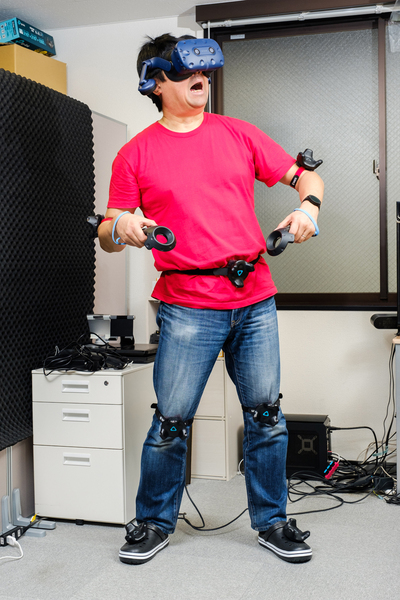
This screenshot has height=600, width=400. I want to click on handles on side cabinets, so click(x=70, y=463), click(x=76, y=414), click(x=81, y=390).